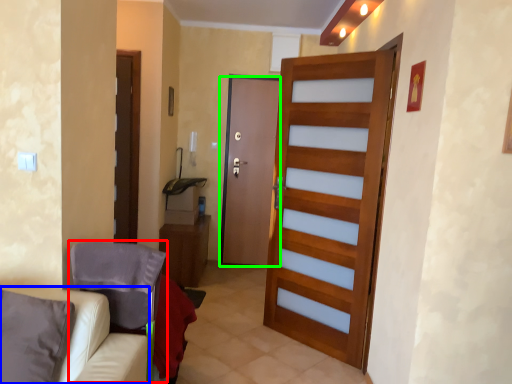
Question: Which object is positioned farthest from armchair (highlighted by a red box)? Select from furniture (highlighted by a blue box) and door (highlighted by a green box).

Choices:
 (A) furniture
 (B) door

Answer: (B)